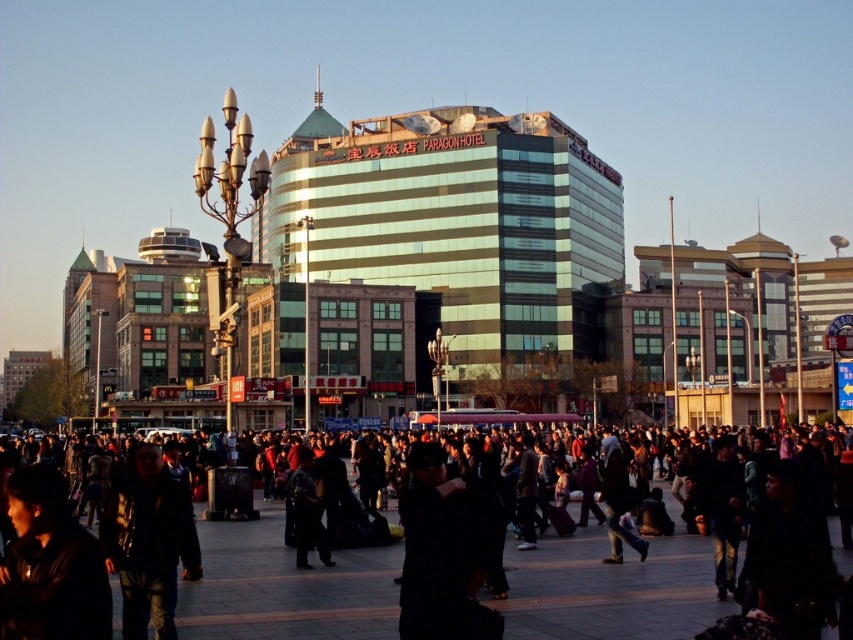
Does black matte crowd at center have a lesser height compared to black matte jacket at center?

Indeed, black matte crowd at center has a lesser height compared to black matte jacket at center.

You are a GUI agent. You are given a task and a screenshot of the screen. Output one action in this format:
    pyautogui.click(x=<x>, y=<y>)
    Task: Click on the black matte crowd at center
    
    Given the screenshot: What is the action you would take?
    pyautogui.click(x=285, y=588)

Can you confirm if black matte crowd at center is bigger than dark matte jacket at lower left?

Correct, black matte crowd at center is larger in size than dark matte jacket at lower left.

Is point (201, 536) more distant than point (105, 609)?

Yes, point (201, 536) is behind point (105, 609).

What are the coordinates of `black matte crowd at center` in the screenshot? It's located at (285, 588).

Who is positioned more to the left, dark matte jacket at lower left or dark gray fabric jacket at center?

From the viewer's perspective, dark matte jacket at lower left appears more on the left side.

Does point (27, 561) come in front of point (294, 508)?

Yes, it is in front of point (294, 508).

This screenshot has width=853, height=640. What are the coordinates of `dark matte jacket at lower left` in the screenshot? It's located at (50, 564).